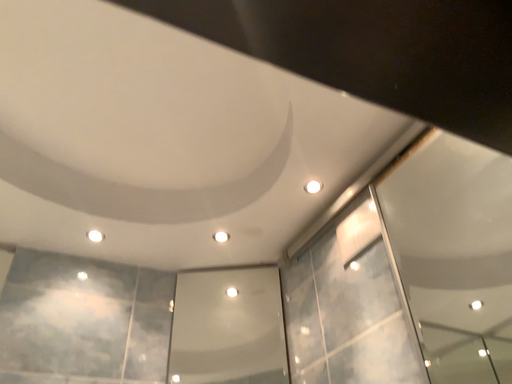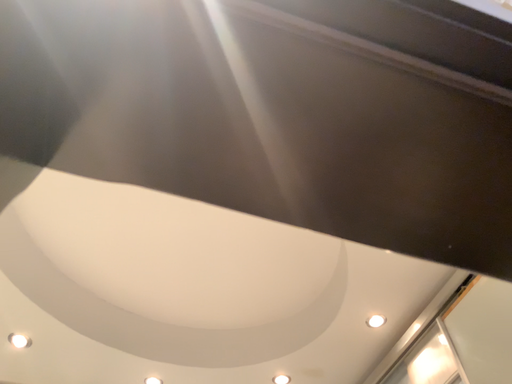
Question: Which way did the camera rotate in the video?

Choices:
 (A) rotated right
 (B) rotated left

Answer: (B)